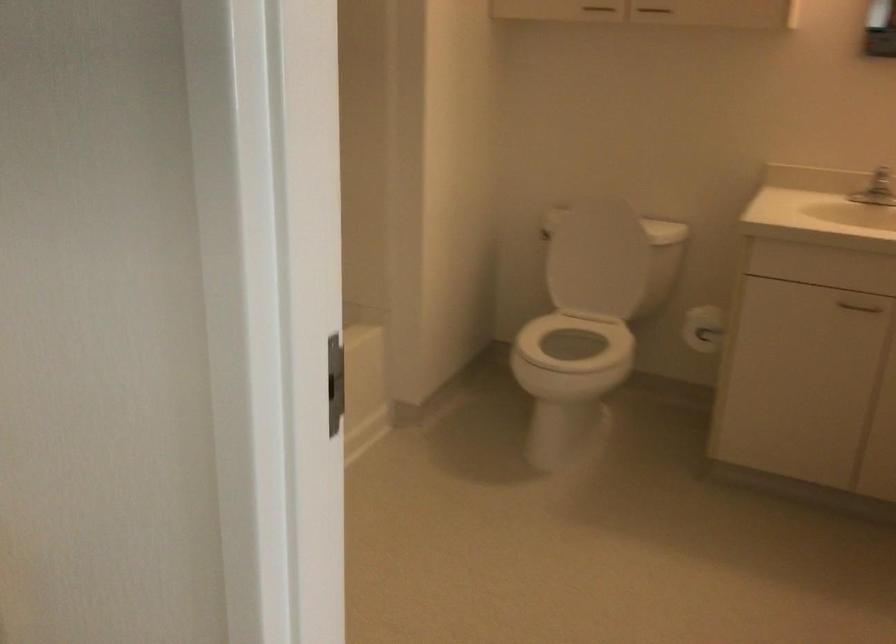
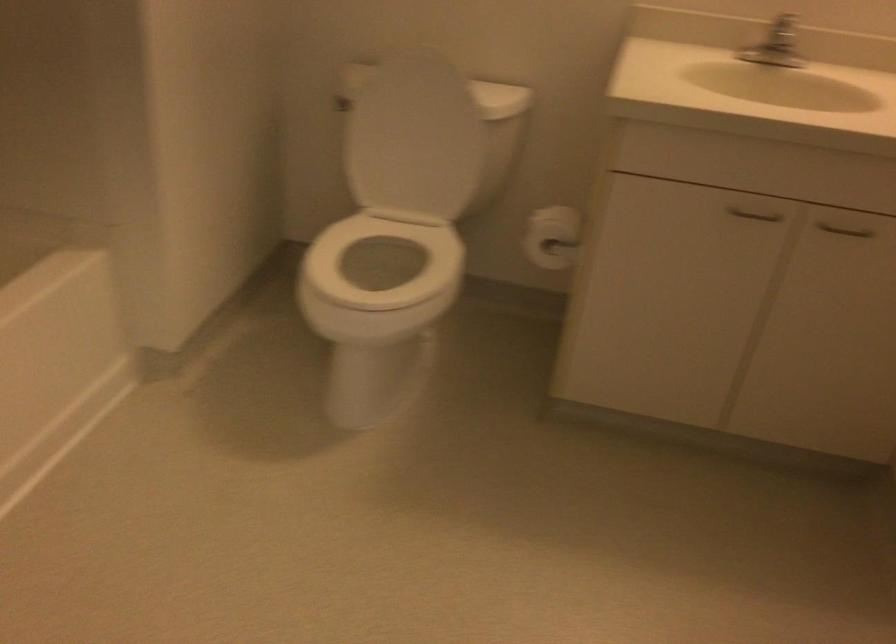
Locate, in the second image, the point that corresponds to point 613,204 in the first image.

(440, 61)